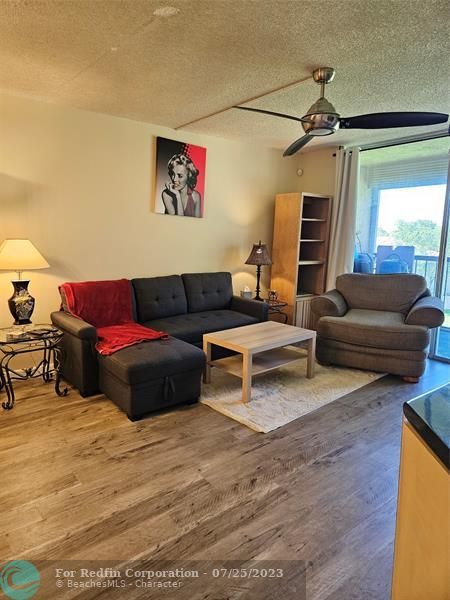
I want to click on curtain, so click(345, 210).